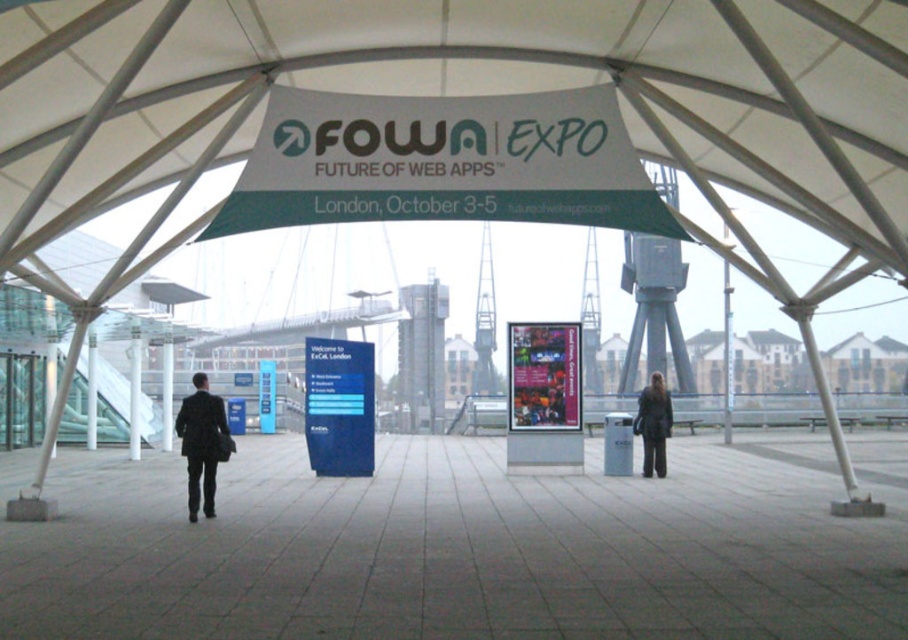
Question: Which point is farther from the camera taking this photo?

Choices:
 (A) (192, 460)
 (B) (132, 344)

Answer: (B)

Question: Does white fabric canopy at center have a greater width compared to matte plastic poster at center?

Choices:
 (A) yes
 (B) no

Answer: (A)

Question: Estimate the real-world distances between objects in this image. Which object is farther from the white glossy pillar at center?

Choices:
 (A) blue plastic sign at center
 (B) matte plastic poster at center
 (C) white fabric canopy at center
 (D) dark gray suit at left

Answer: (C)

Question: Does white fabric canopy at center appear on the left side of white glossy pillar at left?

Choices:
 (A) no
 (B) yes

Answer: (A)

Question: Which point is closer to the camera?

Choices:
 (A) dark brown leather jacket at lower right
 (B) blue plastic sign at center
 (C) white fabric canopy at center

Answer: (C)

Question: Is blue plastic sign at center to the right of blue glossy sign at center from the viewer's perspective?

Choices:
 (A) yes
 (B) no

Answer: (A)